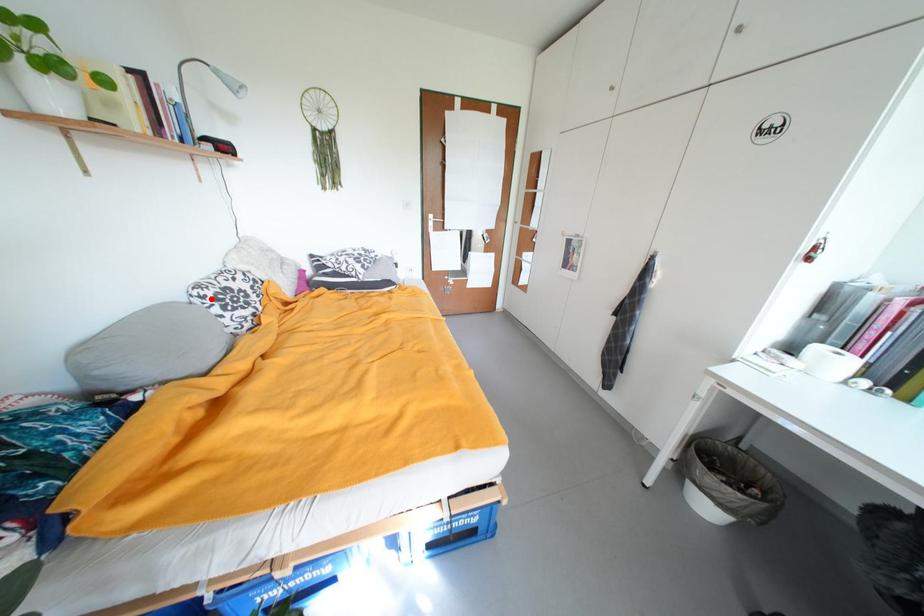
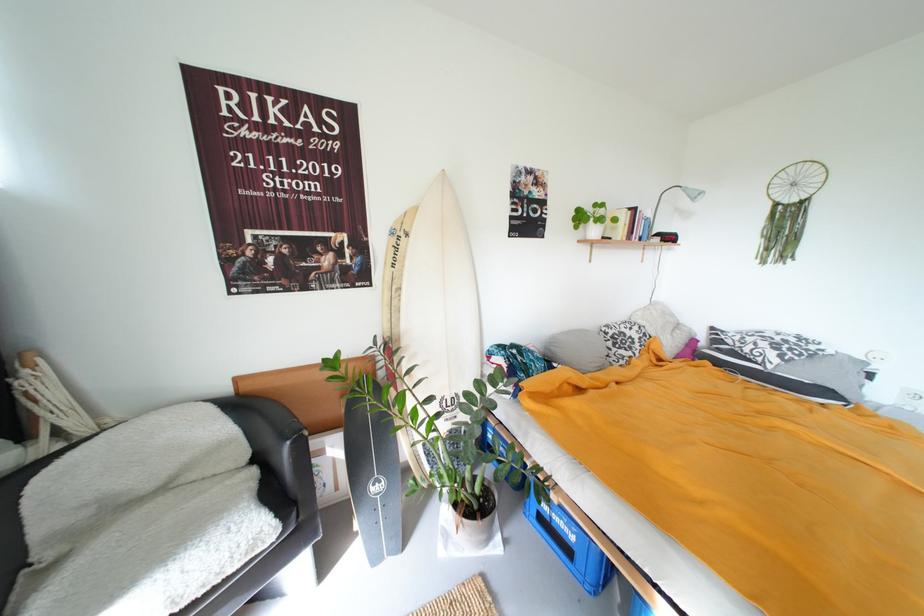
Find the pixel in the second image that matches the highlighted location in the first image.

(614, 334)